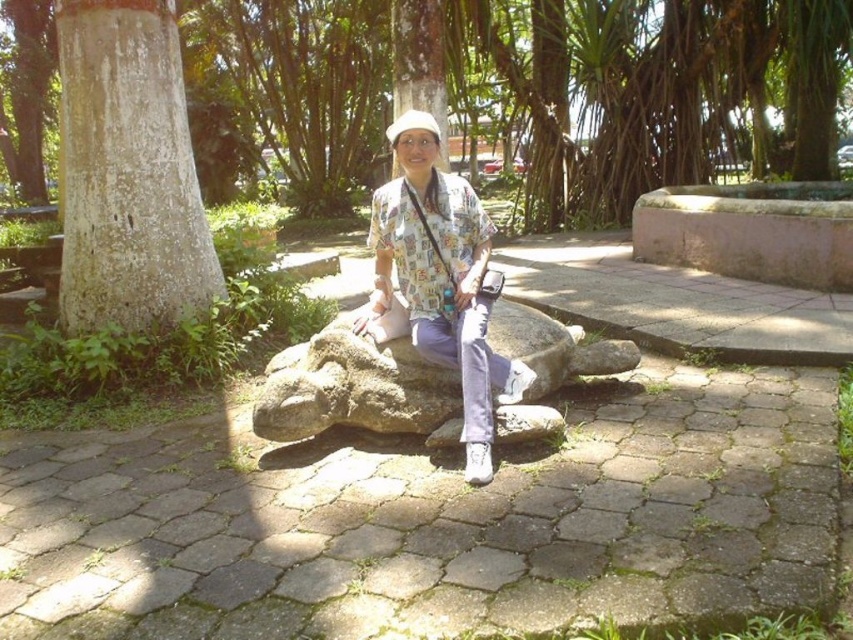
Question: Does white rough textured tree trunk at left have a smaller size compared to matte floral shirt at center?

Choices:
 (A) no
 (B) yes

Answer: (A)

Question: Considering the relative positions of white rough textured tree trunk at left and matte floral shirt at center in the image provided, where is white rough textured tree trunk at left located with respect to matte floral shirt at center?

Choices:
 (A) left
 (B) right

Answer: (A)

Question: Which point is closer to the camera?

Choices:
 (A) (459, 241)
 (B) (151, 10)

Answer: (A)

Question: Is white rough textured tree trunk at left above matte floral shirt at center?

Choices:
 (A) yes
 (B) no

Answer: (A)

Question: Among these points, which one is farthest from the camera?

Choices:
 (A) (439, 173)
 (B) (131, 320)

Answer: (B)